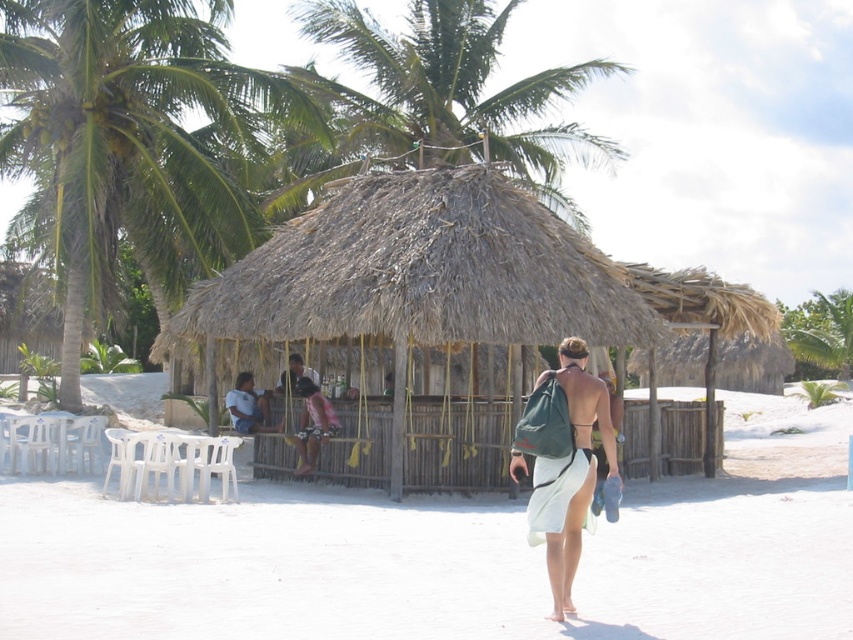
Who is positioned more to the left, white plastic chairs at lower left or green leafy palm tree at upper center?

Positioned to the left is green leafy palm tree at upper center.

Describe the element at coordinates (450, 556) in the screenshot. The width and height of the screenshot is (853, 640). I see `white plastic chairs at lower left` at that location.

Which is behind, point (135, 596) or point (425, 1)?

The point (425, 1) is behind.

Where is `white plastic chairs at lower left`? This screenshot has width=853, height=640. white plastic chairs at lower left is located at coordinates (450, 556).

Can you confirm if green leafy palm tree at upper center is wider than green leafy palm tree at upper right?

Indeed, green leafy palm tree at upper center has a greater width compared to green leafy palm tree at upper right.

Can you confirm if green leafy palm tree at upper center is smaller than green leafy palm tree at upper right?

Incorrect, green leafy palm tree at upper center is not smaller in size than green leafy palm tree at upper right.

Is point (492, 10) more distant than point (822, 326)?

No, it is in front of (822, 326).

You are a GUI agent. You are given a task and a screenshot of the screen. Output one action in this format:
    pyautogui.click(x=<x>, y=<y>)
    Task: Click on the green leafy palm tree at upper center
    The image size is (853, 640).
    Given the screenshot: What is the action you would take?
    pyautogui.click(x=450, y=93)

Is green leafy palm tree at upper center above green fabric backpack at center?

Yes.

Is green leafy palm tree at upper center bigger than green fabric backpack at center?

Yes, green leafy palm tree at upper center is bigger than green fabric backpack at center.

Which is in front, point (543, 93) or point (575, 458)?

Point (575, 458) is more forward.

Locate an element on the screen. Image resolution: width=853 pixels, height=640 pixels. green leafy palm tree at upper center is located at coordinates (450, 93).